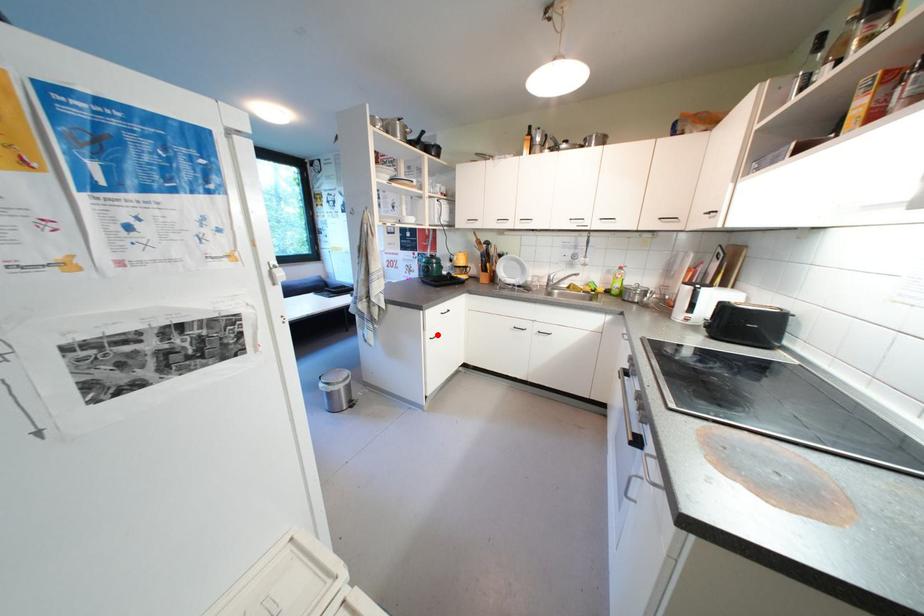
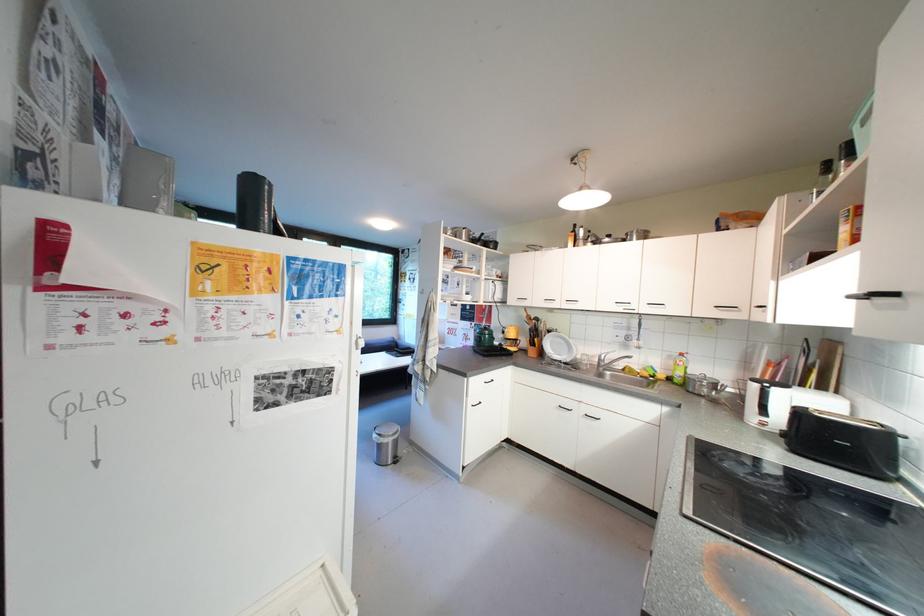
Question: I am providing you with two images of the same scene from different viewpoints. In image1, a red point is highlighted. Considering the same 3D point in image2, which of the following is correct?

Choices:
 (A) It is closer
 (B) It is farther

Answer: (B)